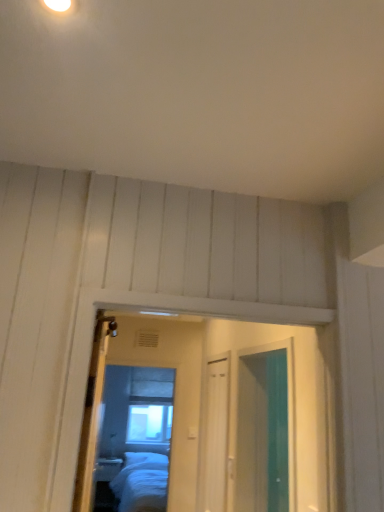
The height and width of the screenshot is (512, 384). In order to click on blank space situated above matte glass mirror at center (from a real-world perspective) in this screenshot , I will do `click(152, 362)`.